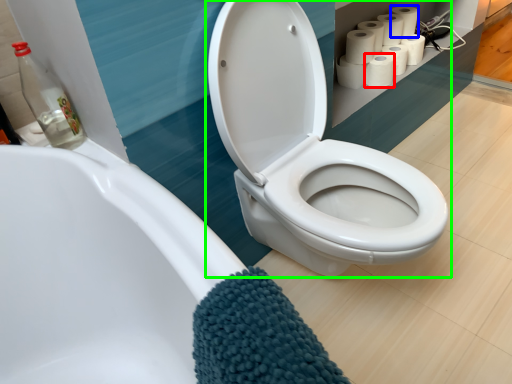
Question: Considering the real-world distances, which object is farthest from toilet paper (highlighted by a red box)? toilet paper (highlighted by a blue box) or toilet (highlighted by a green box)?

Choices:
 (A) toilet paper
 (B) toilet

Answer: (B)